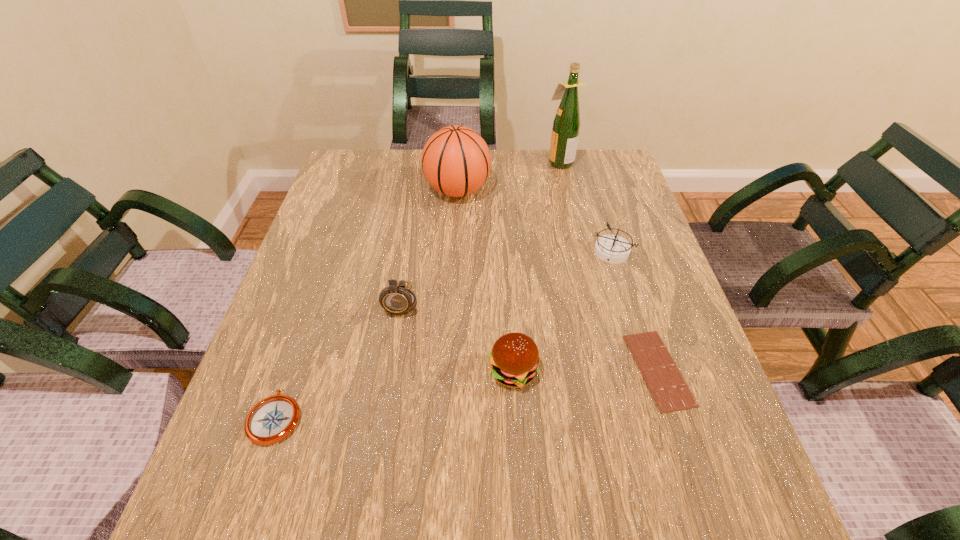
At what (x,y) coordinates should I click in order to perform the action: click on the nearest compass. Please return your answer as a coordinate pair (x, y). Looking at the image, I should click on (272, 419).

At what (x,y) coordinates should I click in order to perform the action: click on the shortest object. Please return your answer as a coordinate pair (x, y). This screenshot has height=540, width=960. Looking at the image, I should click on (670, 391).

This screenshot has width=960, height=540. Find the location of `vacant space located on the front-facing side of the farthest object`. vacant space located on the front-facing side of the farthest object is located at coordinates (424, 161).

Image resolution: width=960 pixels, height=540 pixels. Find the location of `free location located on the front-facing side of the farthest object`. free location located on the front-facing side of the farthest object is located at coordinates (523, 161).

Where is `free space located on the front-facing side of the farthest object`? free space located on the front-facing side of the farthest object is located at coordinates (472, 161).

Locate an element on the screen. The image size is (960, 540). vacant point located 0.060m on the left of the sixth nearest object is located at coordinates (404, 191).

Identify the location of blank area located on the face of the third tallest object. (388, 381).

This screenshot has width=960, height=540. In order to click on free space located on the front of the fourth shortest object in this screenshot , I will do `click(519, 478)`.

The image size is (960, 540). Find the location of `vacant space situated on the front of the farthest compass`. vacant space situated on the front of the farthest compass is located at coordinates (637, 333).

The image size is (960, 540). Find the location of `vacant space positioned 0.080m on the right of the leftmost compass`. vacant space positioned 0.080m on the right of the leftmost compass is located at coordinates (347, 417).